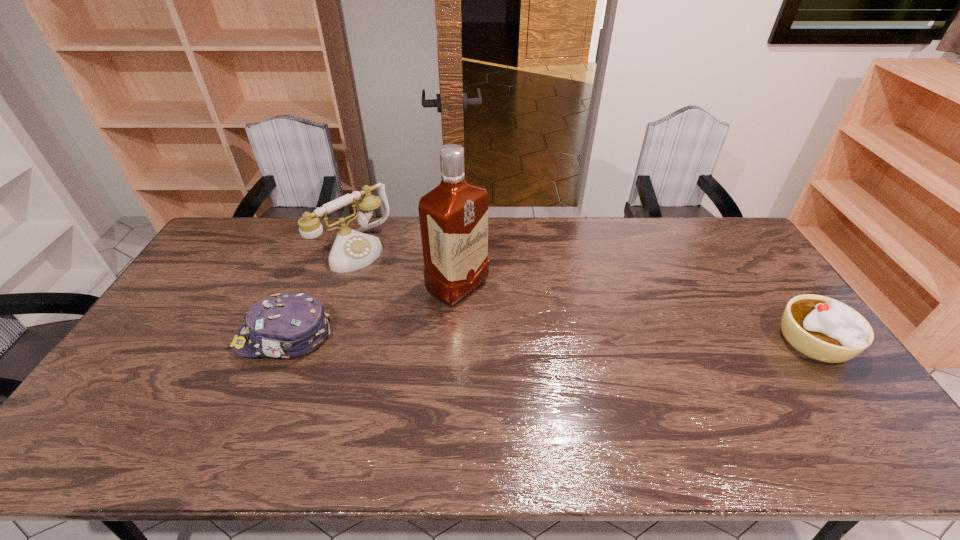
Where is `free space on the desktop that is between the shortest object and the whipped cream and is positioned on the front label of the second object from right to left`? This screenshot has width=960, height=540. free space on the desktop that is between the shortest object and the whipped cream and is positioned on the front label of the second object from right to left is located at coordinates (537, 339).

The image size is (960, 540). What are the coordinates of `vacant space on the desktop that is between the shortest object and the whipped cream and is positioned on the dial of the third shortest object` in the screenshot? It's located at (473, 338).